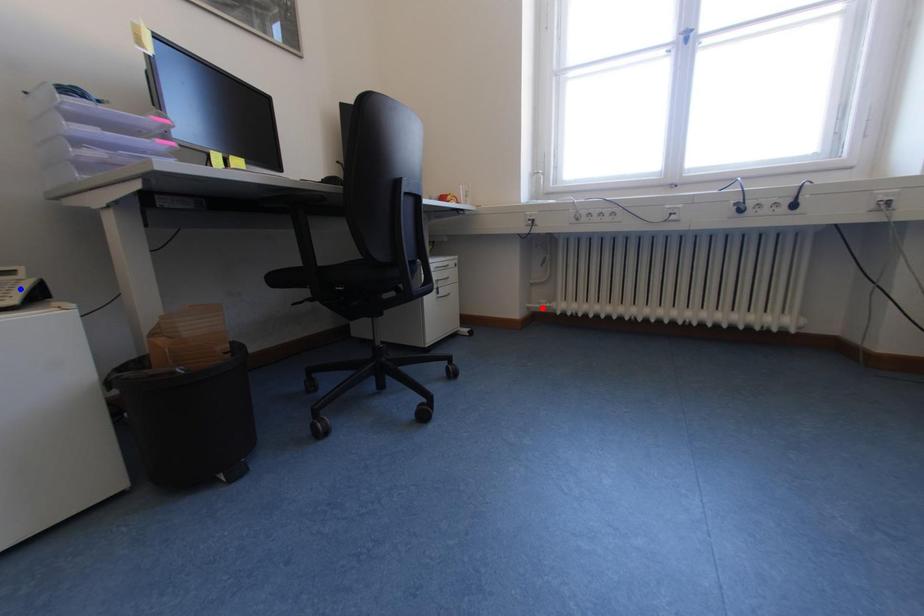
Question: In the image, two points are highlighted. Which point is nearer to the camera? Reply with the corresponding letter.

Choices:
 (A) blue point
 (B) red point

Answer: (A)